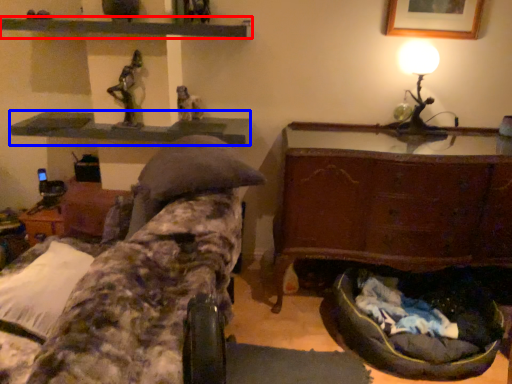
Question: Which object appears farthest to the camera in this image, shelf (highlighted by a red box) or shelf (highlighted by a blue box)?

Choices:
 (A) shelf
 (B) shelf

Answer: (B)